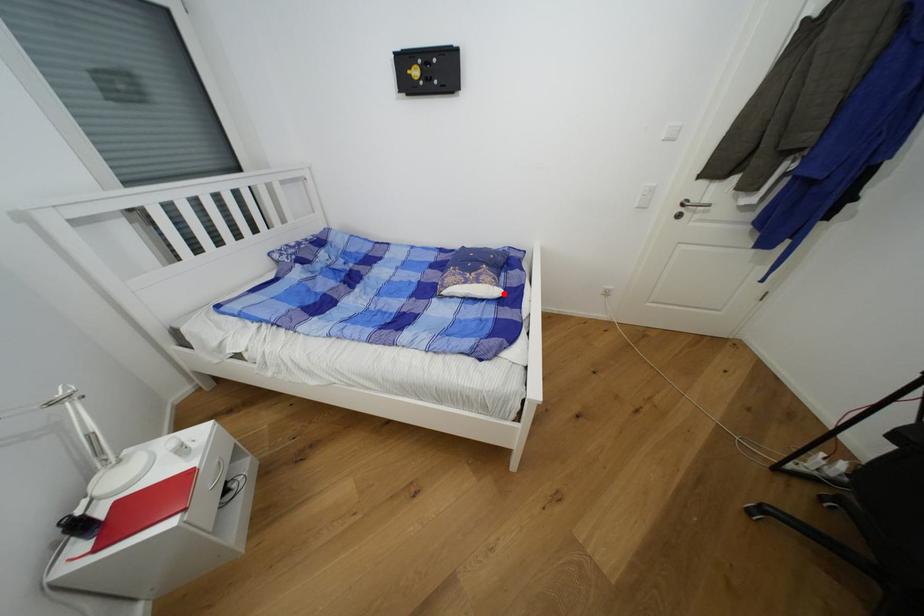
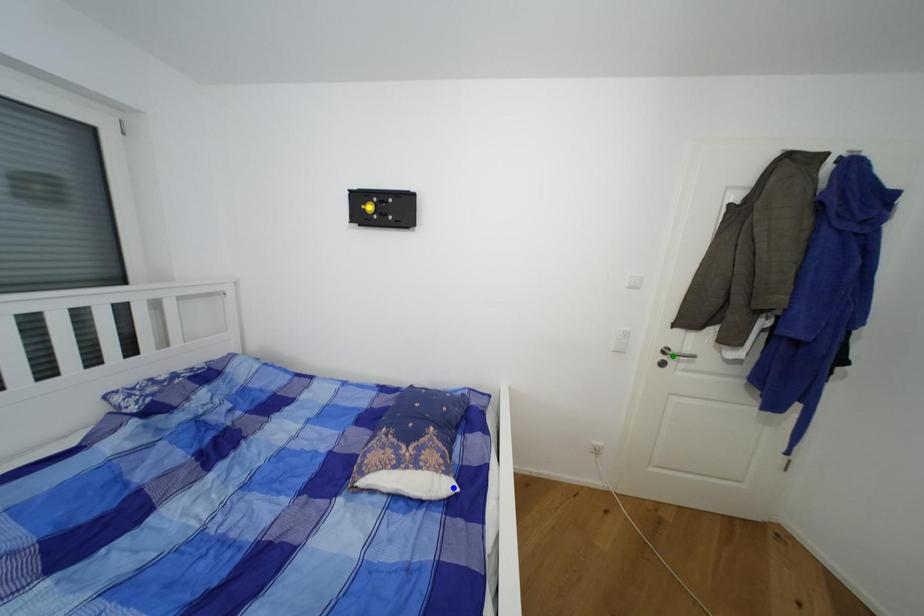
Question: I am providing you with two images of the same scene from different viewpoints. A red point is marked on the first image. You are given multiple points on the second image. Which point in image 2 is actually the same real-world point as the red point in image 1?

Choices:
 (A) blue point
 (B) yellow point
 (C) green point

Answer: (A)